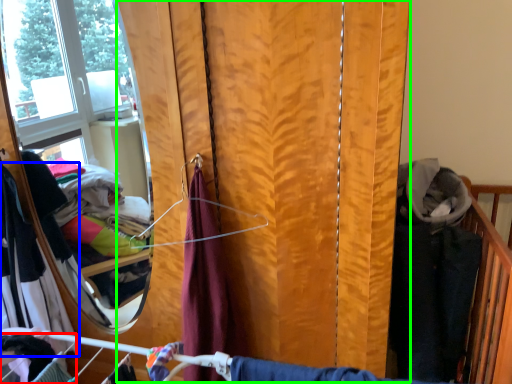
Question: Which object is positioned farthest from clothing (highlighted by a red box)? Select from clothing (highlighted by a blue box) and curtain (highlighted by a green box).

Choices:
 (A) clothing
 (B) curtain

Answer: (B)